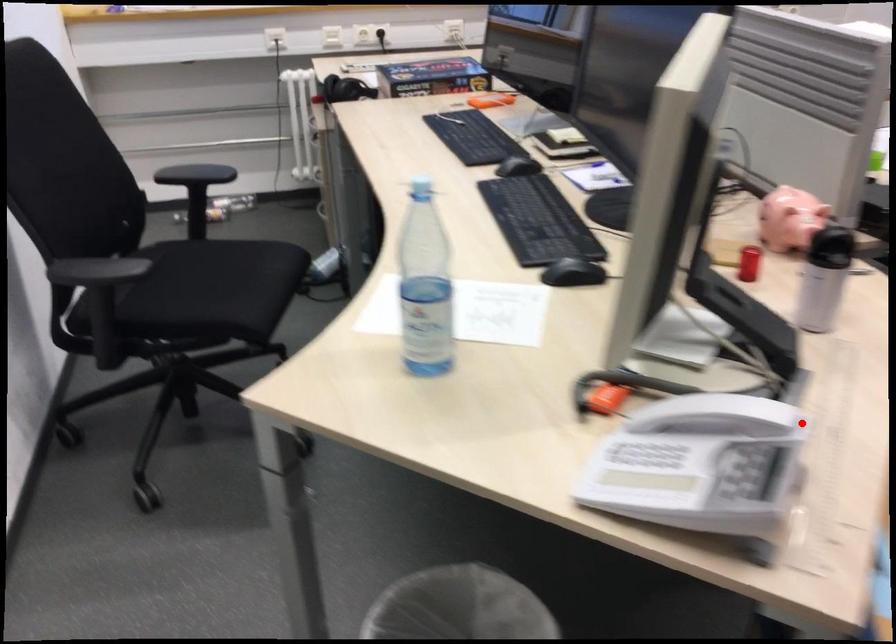
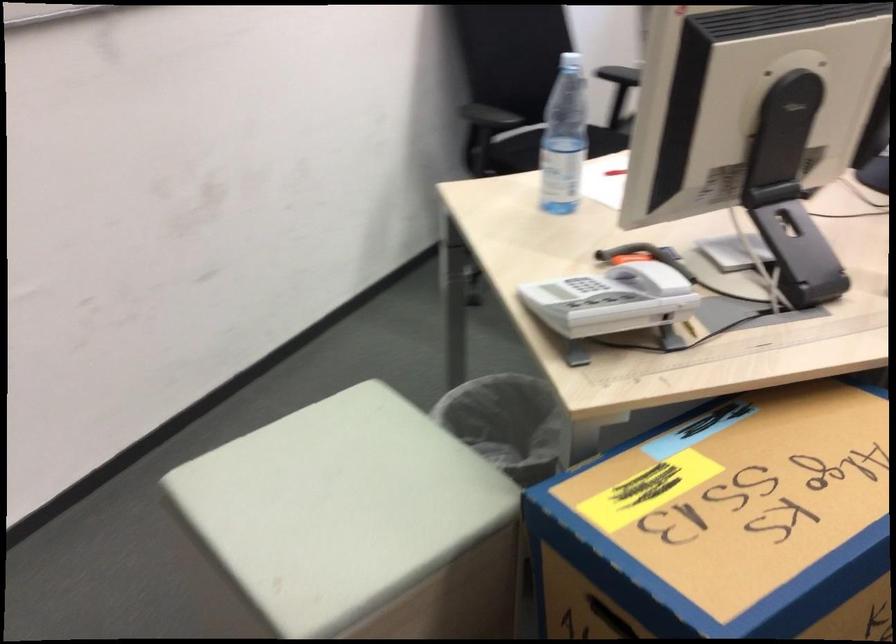
Question: I am providing you with two images of the same scene from different viewpoints. A red point is shown in image1. For the corresponding object point in image2, is it positioned nearer or farther from the camera?

Choices:
 (A) Nearer
 (B) Farther

Answer: (B)